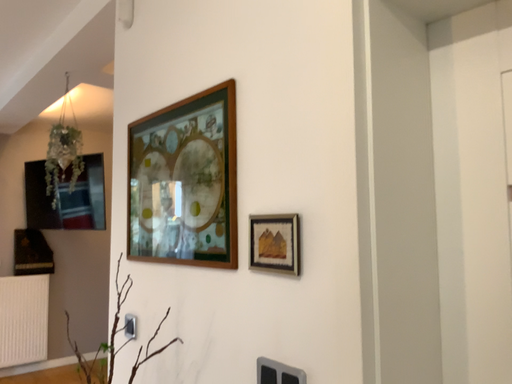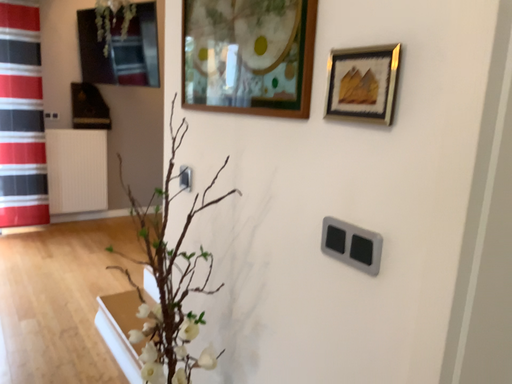
Question: Which way did the camera rotate in the video?

Choices:
 (A) rotated left
 (B) rotated right

Answer: (A)